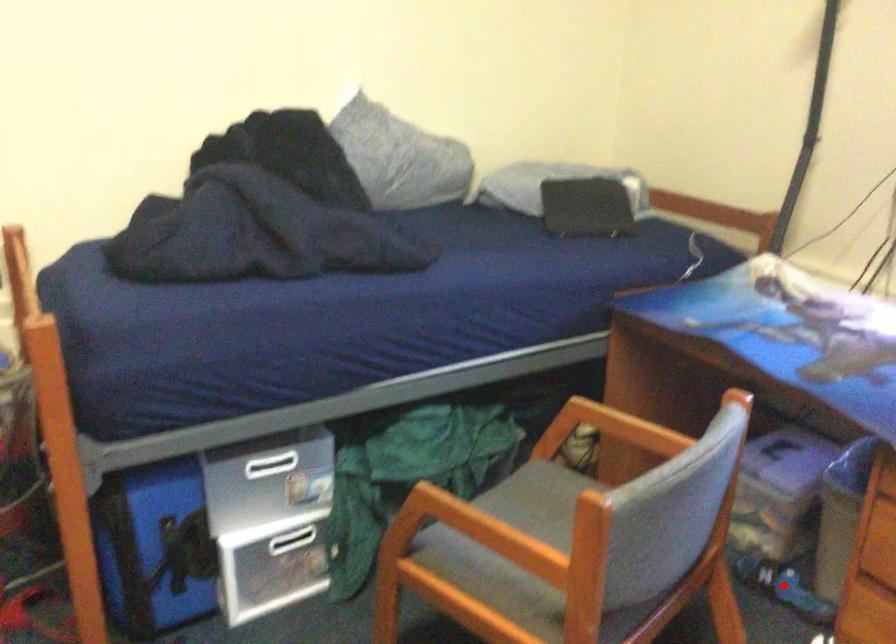
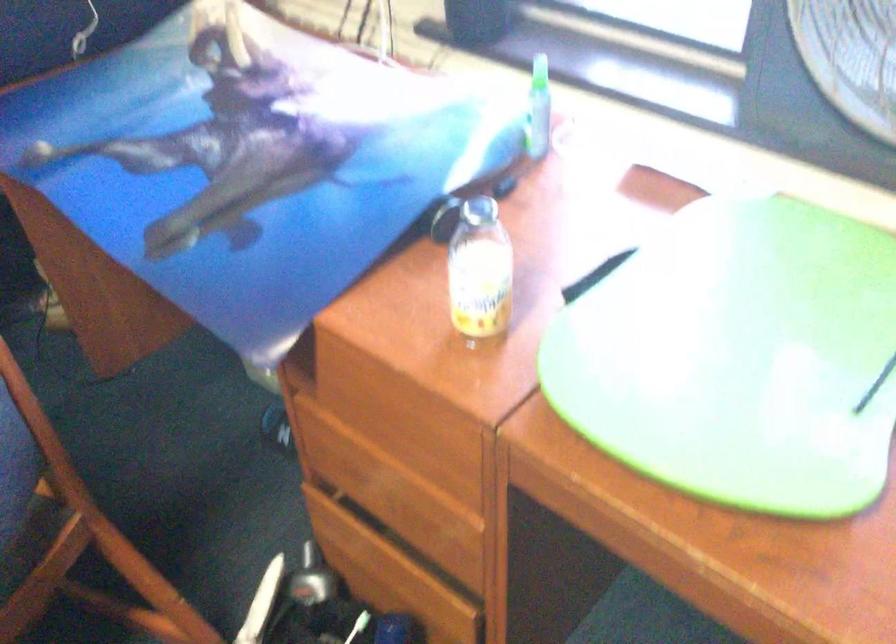
Question: I am providing you with two images of the same scene from different viewpoints. A red point is marked on the first image. Can you still see the location of the red point in image 2?

Choices:
 (A) Yes
 (B) No

Answer: (B)